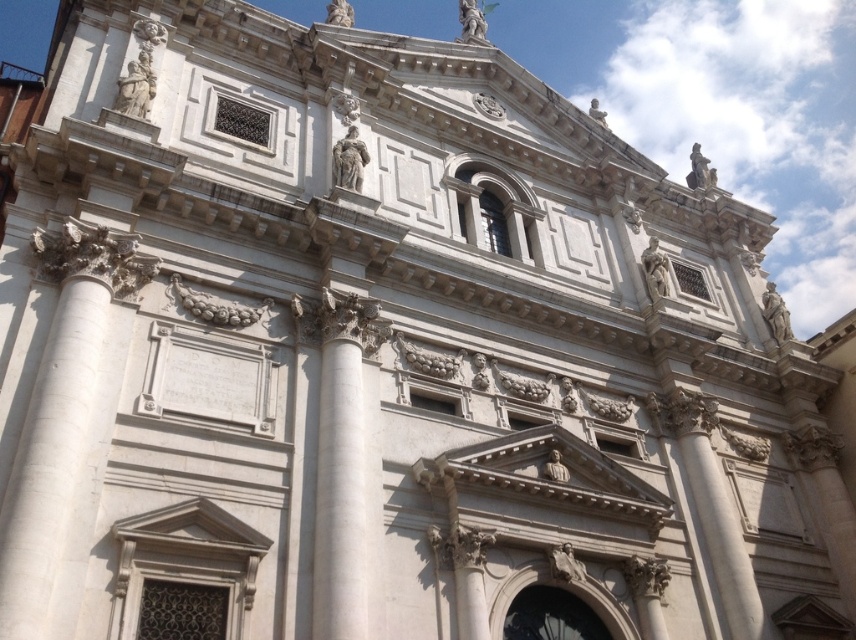
What do you see at coordinates (51, 458) in the screenshot?
I see `white marble column at left` at bounding box center [51, 458].

Who is higher up, white marble column at left or white marble column at center?

Positioned higher is white marble column at left.

You are a GUI agent. You are given a task and a screenshot of the screen. Output one action in this format:
    pyautogui.click(x=<x>, y=<y>)
    Task: Click on the white marble column at left
    This screenshot has width=856, height=640.
    Given the screenshot: What is the action you would take?
    pyautogui.click(x=51, y=458)

I want to click on white marble column at left, so click(x=51, y=458).